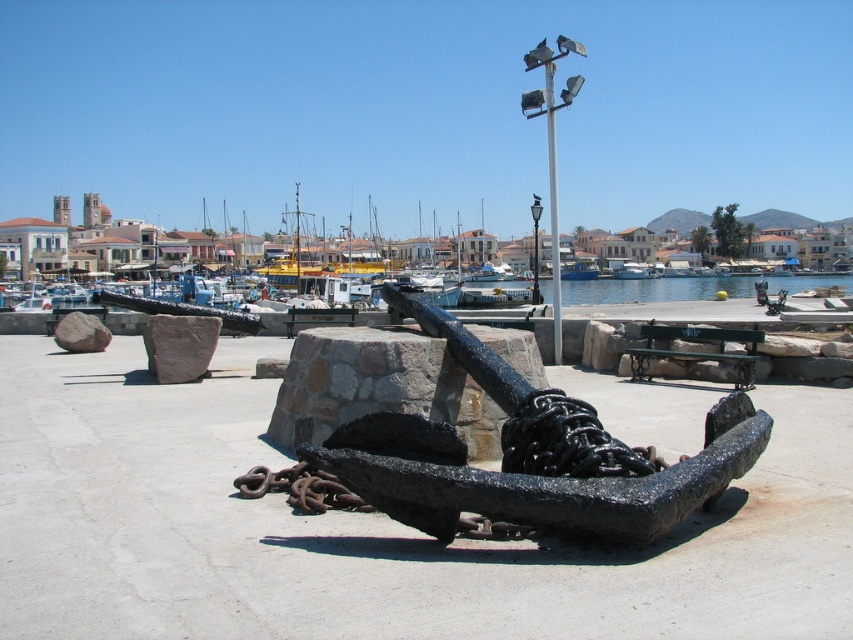
Based on the photo, you are standing at the point marked by the coordinates point [654,289]. What is the closest object to you in the scene?

The closest object to you at point [654,289] is the blue water at center since the coordinates directly correspond to its location.

You are a photographer trying to capture the rusty metal chain at center and the blue water at center in the same frame. Based on their positions, which object should you adjust your camera to focus on first if you want to include both in your shot?

The blue water at center is positioned on the right side of rusty metal chain at center, so you should focus on the rusty metal chain at center first to ensure both objects are included in the frame.

You are standing at the entrance of the marina and want to sit on the black metal bench at center. Based on the coordinates provided, in which general direction should you walk from the entrance to reach the bench?

The black metal bench at center is located at coordinates point (697, 349), which means it is positioned towards the center of the scene. Walk straight ahead from the entrance to reach the bench.